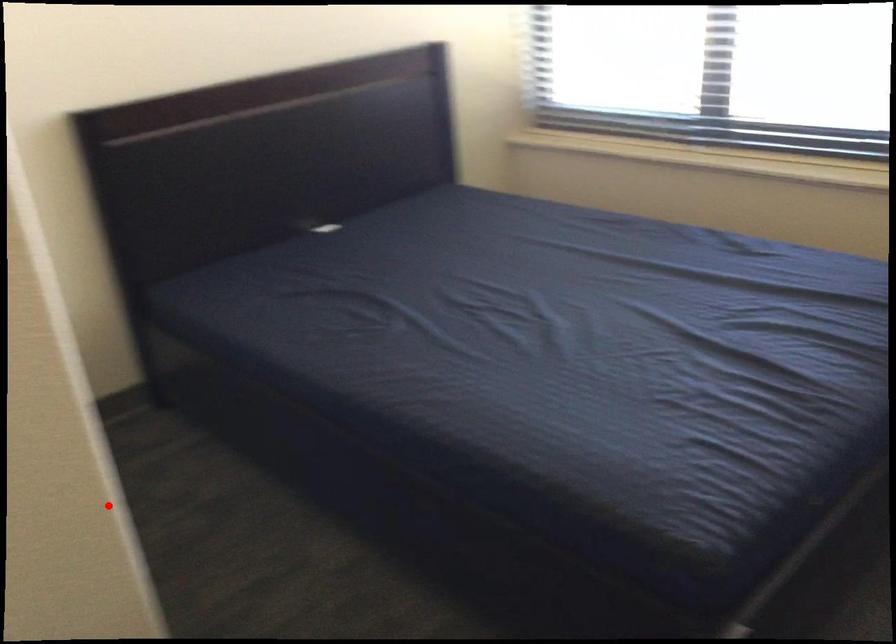
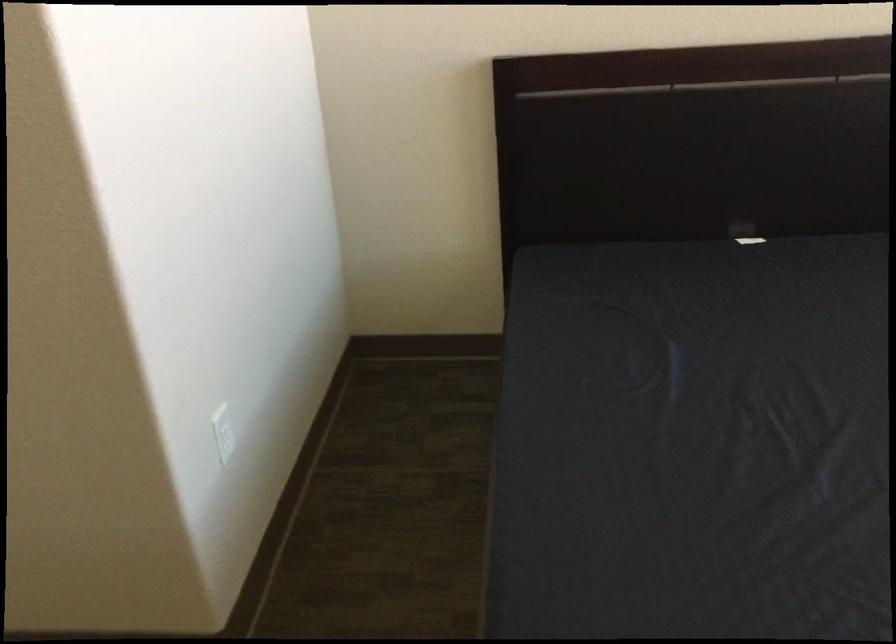
Question: A red point is marked in image1. In image2, is the corresponding 3D point closer to the camera or farther? Reply with the corresponding letter.

Choices:
 (A) The corresponding 3D point is closer.
 (B) The corresponding 3D point is farther.

Answer: (B)